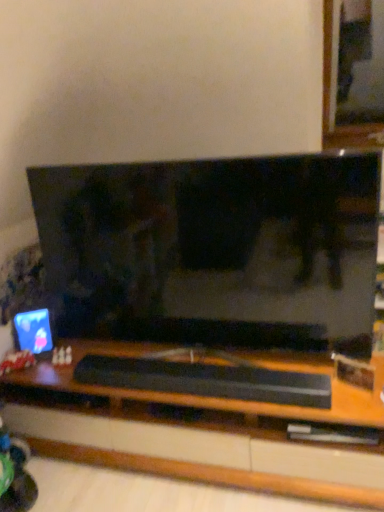
Where is `free space above black matte soundbar at center (from a real-world perspective)`? The width and height of the screenshot is (384, 512). free space above black matte soundbar at center (from a real-world perspective) is located at coordinates [215, 367].